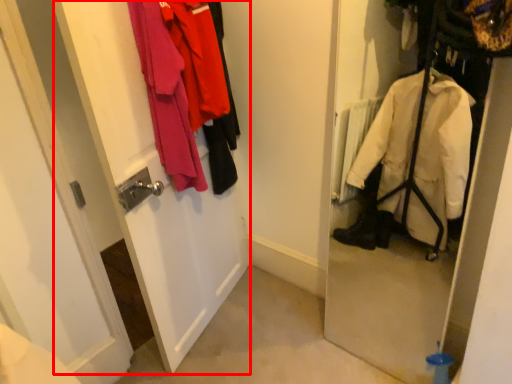
Question: Considering the relative positions of screen door (annotated by the red box) and laundry in the image provided, where is screen door (annotated by the red box) located with respect to the staircase?

Choices:
 (A) left
 (B) right

Answer: (A)